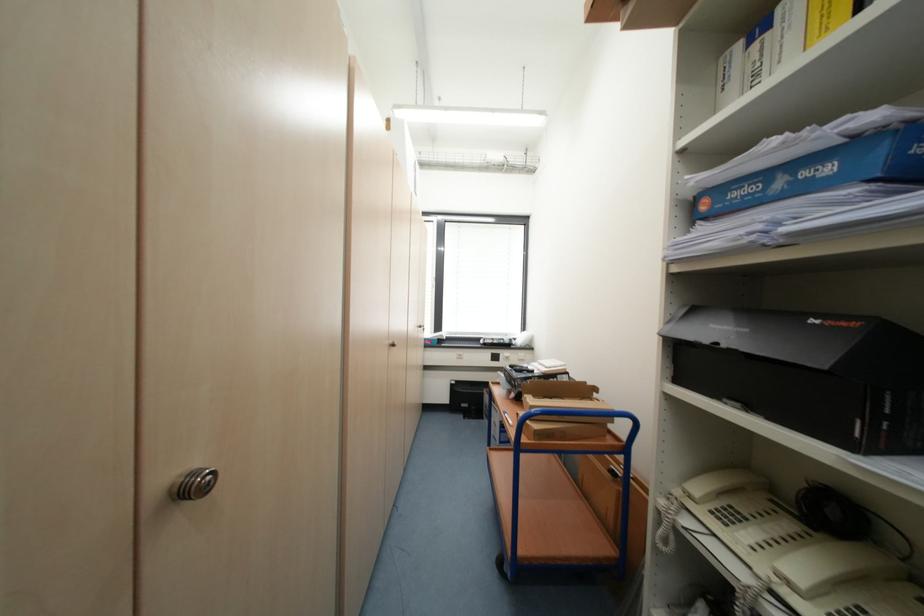
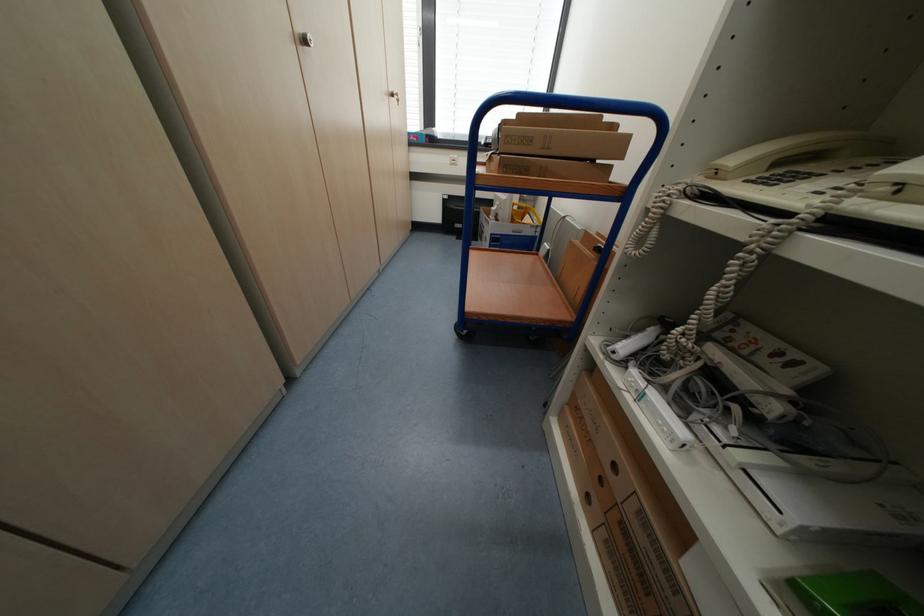
Find the pixel in the second image that matches pixel 427 328 in the first image.

(398, 95)